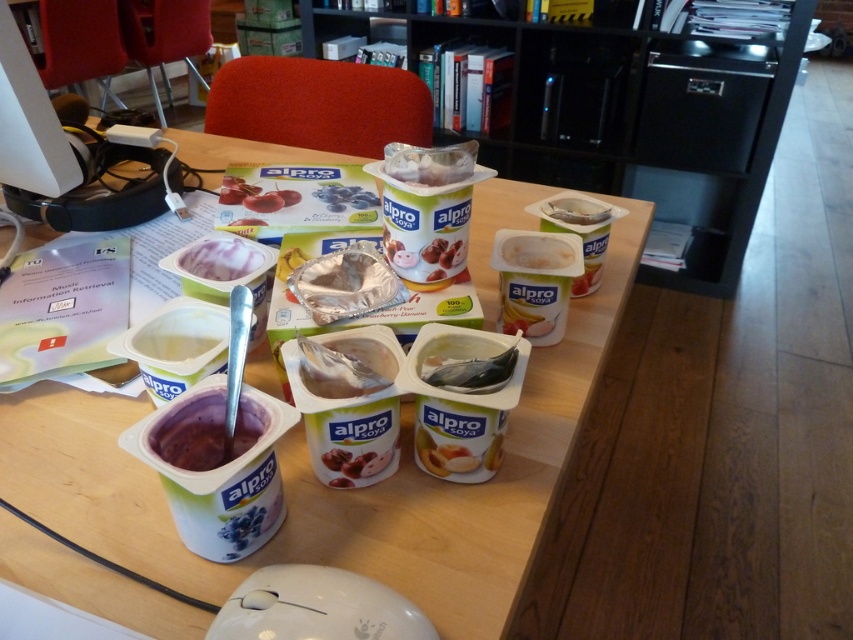
Question: Which point is closer to the camera?

Choices:
 (A) (581, 205)
 (B) (329, 184)
 (C) (355, 628)

Answer: (C)

Question: Does matte white yogurt at center have a larger size compared to translucent plastic fish at center?

Choices:
 (A) no
 (B) yes

Answer: (A)

Question: Does purple matte yogurt at lower left lie behind white plastic container at upper right?

Choices:
 (A) no
 (B) yes

Answer: (A)

Question: Which object is the farthest from the translucent plastic fish at center?

Choices:
 (A) matte plastic yogurt cup at center
 (B) matte white yogurt at center
 (C) purple matte yogurt at lower left

Answer: (A)

Question: Does matte white yogurt at center appear on the right side of matte plastic yogurt cup at center?

Choices:
 (A) yes
 (B) no

Answer: (B)

Question: Among these objects, which one is nearest to the camera?

Choices:
 (A) white plastic table at center
 (B) white plastic mouse at lower center

Answer: (B)